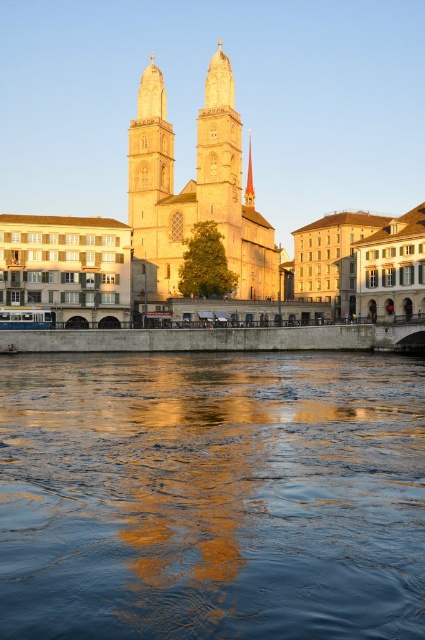
Question: Is blue reflective water at center smaller than golden stone tower at center?

Choices:
 (A) yes
 (B) no

Answer: (A)

Question: Among these objects, which one is farthest from the camera?

Choices:
 (A) gold polished spire at center
 (B) blue reflective water at center

Answer: (A)

Question: Is golden stone tower at center below gold polished spire at center?

Choices:
 (A) no
 (B) yes

Answer: (B)

Question: Which point is farther from the camera taking this photo?

Choices:
 (A) (249, 140)
 (B) (238, 156)
 (C) (212, 376)

Answer: (A)

Question: Estimate the real-world distances between objects in this image. Which object is closer to the blue reflective water at center?

Choices:
 (A) gold polished spire at center
 (B) golden stone tower at center

Answer: (B)

Question: Is blue reflective water at center wider than gold polished spire at center?

Choices:
 (A) no
 (B) yes

Answer: (B)